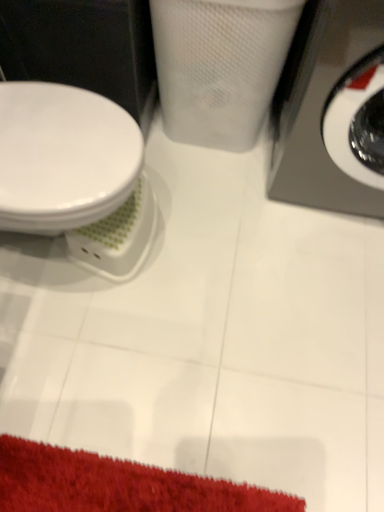
Where is `white glossy toilet at left`? white glossy toilet at left is located at coordinates (76, 175).

What do you see at coordinates (76, 175) in the screenshot?
I see `white glossy toilet at left` at bounding box center [76, 175].

Find the location of a particular element. This screenshot has width=384, height=512. metallic gray washing machine at right is located at coordinates (321, 106).

The height and width of the screenshot is (512, 384). What do you see at coordinates (321, 106) in the screenshot?
I see `metallic gray washing machine at right` at bounding box center [321, 106].

Locate an element on the screen. This screenshot has width=384, height=512. white glossy toilet at left is located at coordinates (76, 175).

Considering the positions of objects metallic gray washing machine at right and white glossy toilet at left in the image provided, who is more to the right, metallic gray washing machine at right or white glossy toilet at left?

metallic gray washing machine at right is more to the right.

Considering the positions of objects metallic gray washing machine at right and white glossy toilet at left in the image provided, who is in front, metallic gray washing machine at right or white glossy toilet at left?

metallic gray washing machine at right.

Which is in front, point (334, 16) or point (57, 125)?

Positioned in front is point (334, 16).

Based on the photo, from the image's perspective, is metallic gray washing machine at right over white glossy toilet at left?

Indeed, from the image's perspective, metallic gray washing machine at right is shown above white glossy toilet at left.

From a real-world perspective, is metallic gray washing machine at right physically located above or below white glossy toilet at left?

From a real-world perspective, metallic gray washing machine at right is physically above white glossy toilet at left.

Considering the relative sizes of metallic gray washing machine at right and white glossy toilet at left in the image provided, is metallic gray washing machine at right thinner than white glossy toilet at left?

Incorrect, the width of metallic gray washing machine at right is not less than that of white glossy toilet at left.

Considering the sizes of objects metallic gray washing machine at right and white glossy toilet at left in the image provided, who is shorter, metallic gray washing machine at right or white glossy toilet at left?

white glossy toilet at left is shorter.

Is metallic gray washing machine at right bigger or smaller than white glossy toilet at left?

In the image, metallic gray washing machine at right appears to be larger than white glossy toilet at left.

Is metallic gray washing machine at right spatially inside white glossy toilet at left, or outside of it?

The correct answer is: outside.

Is metallic gray washing machine at right not close to white glossy toilet at left?

metallic gray washing machine at right is near white glossy toilet at left, not far away.

Could you tell me if metallic gray washing machine at right is turned towards white glossy toilet at left?

No, metallic gray washing machine at right does not turn towards white glossy toilet at left.

How different are the orientations of metallic gray washing machine at right and white glossy toilet at left in degrees?

They differ by 89.1 degrees in their facing directions.

Locate an element on the screen. Image resolution: width=384 pixels, height=512 pixels. toilet behind the metallic gray washing machine at right is located at coordinates (76, 175).

Is white glossy toilet at left to the left of metallic gray washing machine at right from the viewer's perspective?

Yes, white glossy toilet at left is to the left of metallic gray washing machine at right.

Does white glossy toilet at left come in front of metallic gray washing machine at right?

No, it is behind metallic gray washing machine at right.

Considering the positions of point (43, 133) and point (373, 45), is point (43, 133) closer or farther from the camera than point (373, 45)?

Point (43, 133) is farther from the camera than point (373, 45).

In the scene shown: From the image's perspective, which one is positioned higher, white glossy toilet at left or metallic gray washing machine at right?

metallic gray washing machine at right.

From a real-world perspective, who is located higher, white glossy toilet at left or metallic gray washing machine at right?

In real-world perspective, metallic gray washing machine at right is above.

Can you confirm if white glossy toilet at left is thinner than metallic gray washing machine at right?

Yes, white glossy toilet at left is thinner than metallic gray washing machine at right.

Which of these two, white glossy toilet at left or metallic gray washing machine at right, stands shorter?

white glossy toilet at left.

Is white glossy toilet at left bigger than metallic gray washing machine at right?

Actually, white glossy toilet at left might be smaller than metallic gray washing machine at right.

Do you think white glossy toilet at left is within metallic gray washing machine at right, or outside of it?

white glossy toilet at left exists outside the volume of metallic gray washing machine at right.

Is white glossy toilet at left far from metallic gray washing machine at right?

white glossy toilet at left is actually quite close to metallic gray washing machine at right.

Is white glossy toilet at left aimed at metallic gray washing machine at right?

No, white glossy toilet at left is not facing towards metallic gray washing machine at right.

Identify the location of toilet below the metallic gray washing machine at right (from the image's perspective). The width and height of the screenshot is (384, 512). (76, 175).

You are a GUI agent. You are given a task and a screenshot of the screen. Output one action in this format:
    pyautogui.click(x=<x>, y=<y>)
    Task: Click on the toilet below the metallic gray washing machine at right (from the image's perspective)
    The height and width of the screenshot is (512, 384).
    Given the screenshot: What is the action you would take?
    pyautogui.click(x=76, y=175)

The height and width of the screenshot is (512, 384). What are the coordinates of `toilet located underneath the metallic gray washing machine at right (from a real-world perspective)` in the screenshot? It's located at (76, 175).